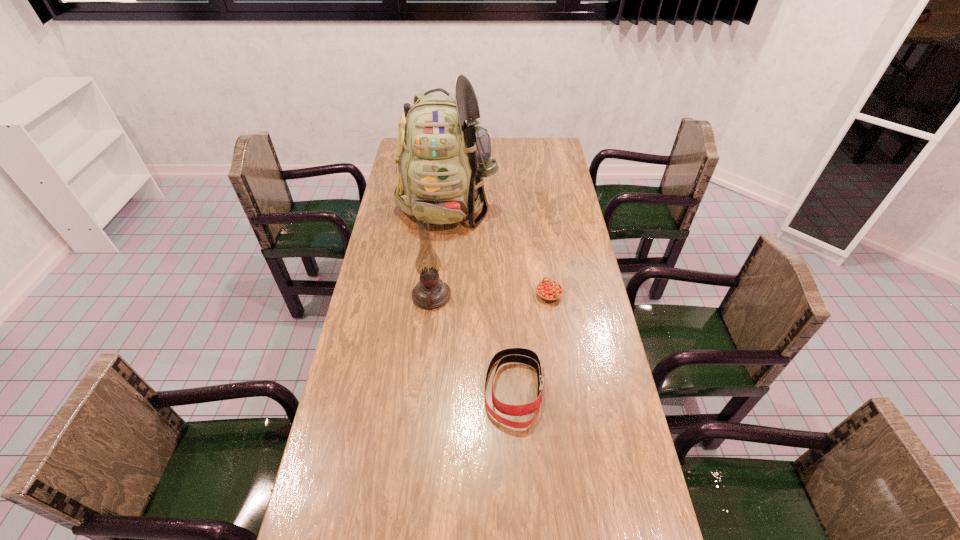
Locate an element on the screen. object present at the right edge is located at coordinates (548, 290).

The width and height of the screenshot is (960, 540). Identify the location of vacant space at the left edge of the desktop. coord(358,391).

Where is `free space at the right edge of the desktop`? The image size is (960, 540). free space at the right edge of the desktop is located at coordinates (606, 335).

Find the location of a particular element. vacant space at the far right corner of the desktop is located at coordinates pyautogui.click(x=553, y=147).

Identify the location of vacant space that's between the third shortest object and the tallest object. (440, 248).

Find the location of a particular element. This screenshot has height=540, width=960. free spot between the backpack and the dog collar is located at coordinates (481, 295).

This screenshot has height=540, width=960. What are the coordinates of `blank region between the nearest object and the backpack` in the screenshot? It's located at (481, 295).

The image size is (960, 540). I want to click on free space that is in between the nearest object and the tallest object, so click(x=481, y=295).

I want to click on vacant area between the rightmost object and the oil lamp, so click(491, 295).

Image resolution: width=960 pixels, height=540 pixels. In order to click on empty location between the strawberry and the dog collar in this screenshot , I will do 532,342.